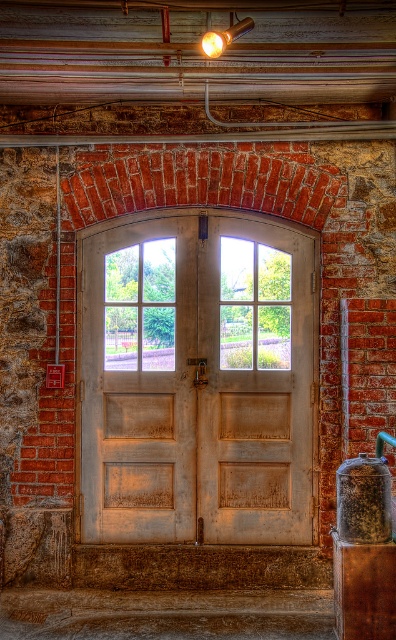
From the picture: You are an interior designer assessing the space. You notice the brown textured pillar at lower right and the matte gold light fixture at upper center. Which object occupies more physical space in the scene?

The brown textured pillar at lower right occupies more physical space in the scene than the matte gold light fixture at upper center because it is bigger.

You are a delivery person with a cart that is 1.5 meters wide. You need to pass through the space between the white wood door at center and the brown textured pillar at lower right. Can your cart fit through the gap?

The distance between the white wood door at center and the brown textured pillar at lower right is 1.41 meters, which is narrower than the cart width of 1.5 meters. Therefore, the cart cannot fit through the gap.